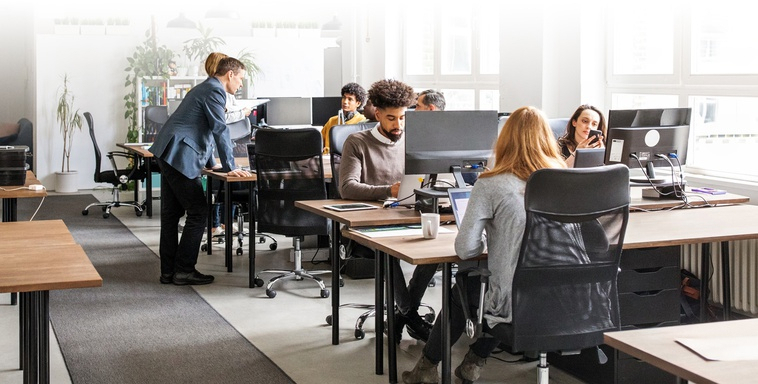
This screenshot has height=384, width=758. I want to click on chair, so click(x=302, y=168), click(x=577, y=273), click(x=345, y=130), click(x=99, y=161), click(x=157, y=118), click(x=561, y=128).